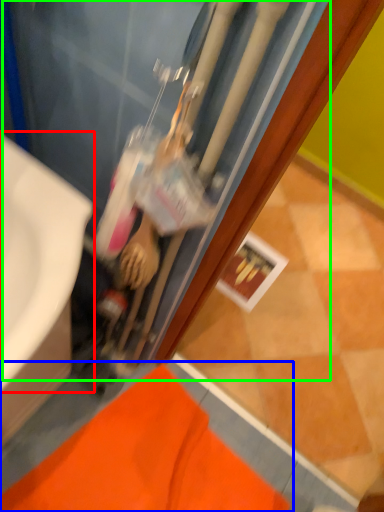
Question: Which object is the closest to the sink (highlighted by a red box)? Choose among these: bath mat (highlighted by a blue box) or water heater (highlighted by a green box).

Choices:
 (A) bath mat
 (B) water heater

Answer: (B)